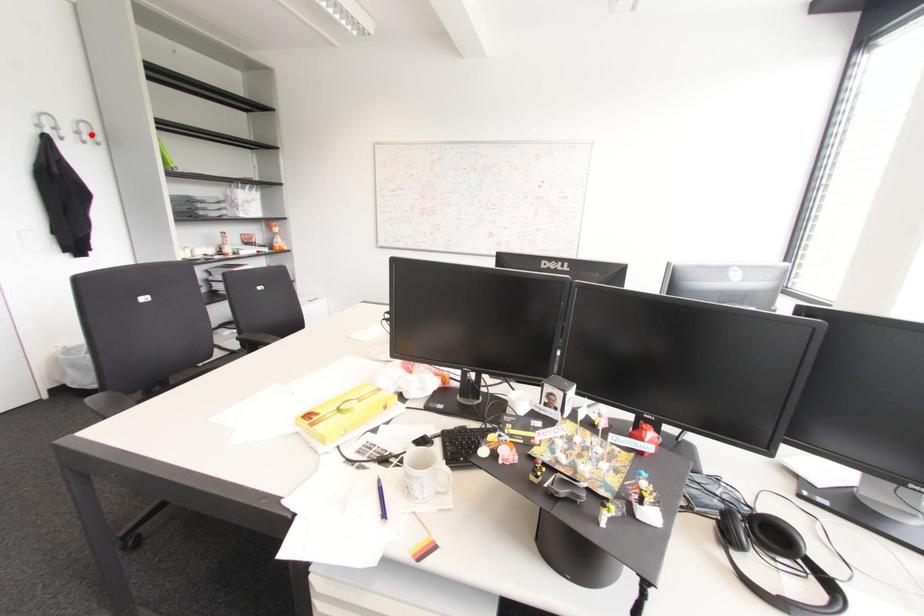
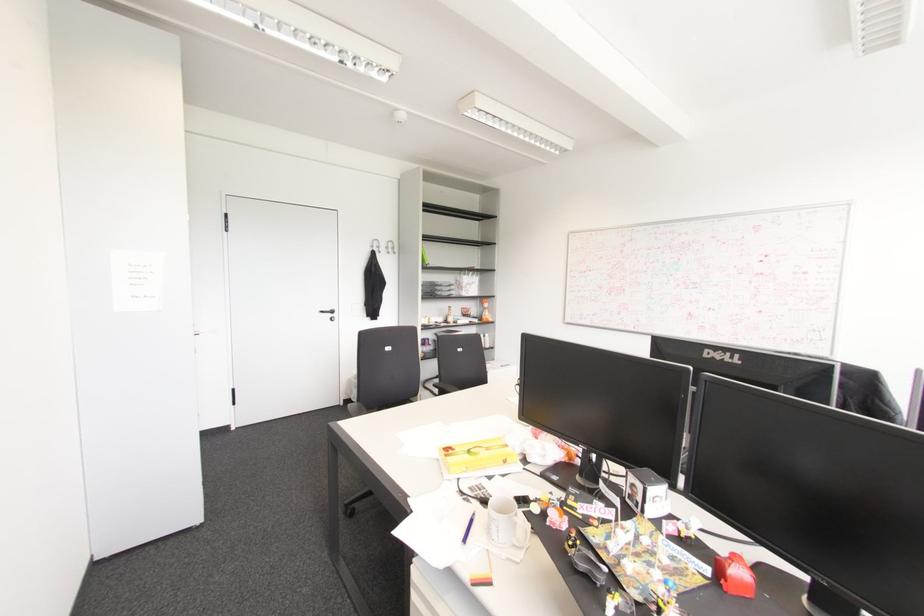
In the second image, find the point that corresponds to the highlighted location in the first image.

(392, 248)